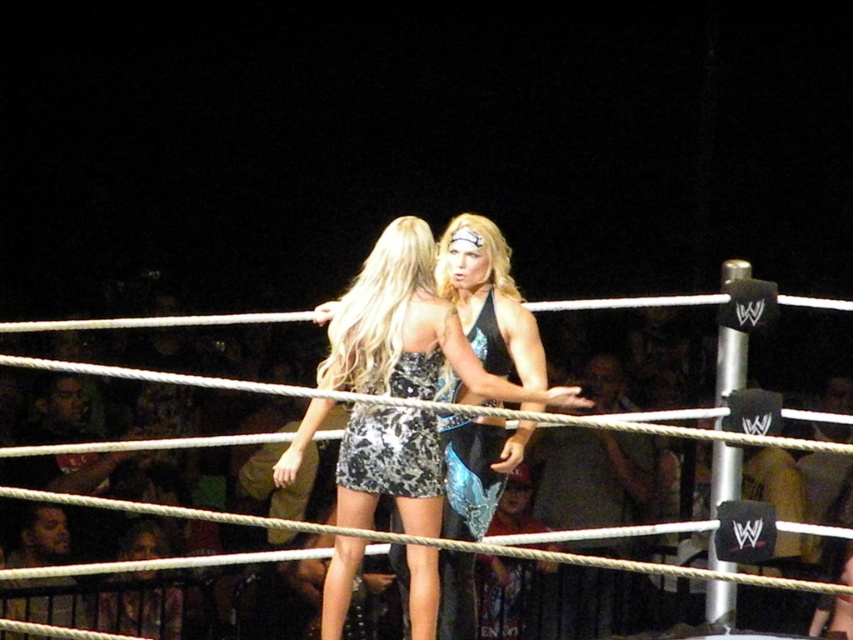
Question: Can you confirm if sparkly black dress at center is wider than shiny metallic dress at center?

Choices:
 (A) no
 (B) yes

Answer: (B)

Question: Is sparkly black dress at center below shiny metallic dress at center?

Choices:
 (A) no
 (B) yes

Answer: (B)

Question: Estimate the real-world distances between objects in this image. Which object is farther from the shiny metallic dress at center?

Choices:
 (A) sparkly metallic dress at center
 (B) sparkly black dress at center

Answer: (A)

Question: Which point is farther to the camera?

Choices:
 (A) (337, 380)
 (B) (399, 410)

Answer: (A)

Question: Which of the following is the closest to the observer?

Choices:
 (A) sparkly metallic dress at center
 (B) shiny metallic dress at center

Answer: (A)

Question: Does sparkly metallic dress at center have a greater width compared to sparkly black dress at center?

Choices:
 (A) yes
 (B) no

Answer: (A)